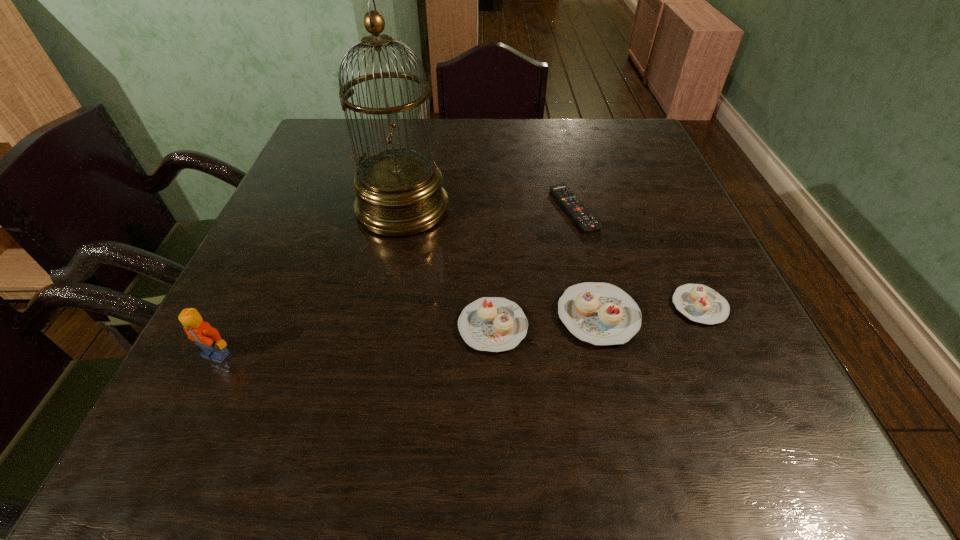
Locate an element on the screen. object situated at the near left corner is located at coordinates (200, 332).

The image size is (960, 540). I want to click on free region at the far edge of the desktop, so click(473, 150).

Identify the location of free space at the near edge. Image resolution: width=960 pixels, height=540 pixels. (545, 374).

I want to click on free space at the left edge, so click(x=334, y=238).

Find the location of `vacant space at the right edge of the desktop`. vacant space at the right edge of the desktop is located at coordinates (697, 232).

Find the location of a particular element. The image size is (960, 540). free space at the far left corner of the desktop is located at coordinates (342, 159).

The height and width of the screenshot is (540, 960). I want to click on free space at the near left corner, so click(197, 361).

Locate an element on the screen. The image size is (960, 540). free spot at the far right corner of the desktop is located at coordinates (590, 134).

This screenshot has height=540, width=960. In order to click on vacant region between the Lego and the shortest cupcake in this screenshot , I will do `click(458, 330)`.

The height and width of the screenshot is (540, 960). I want to click on free spot between the third tallest object and the second object from left to right, so click(500, 262).